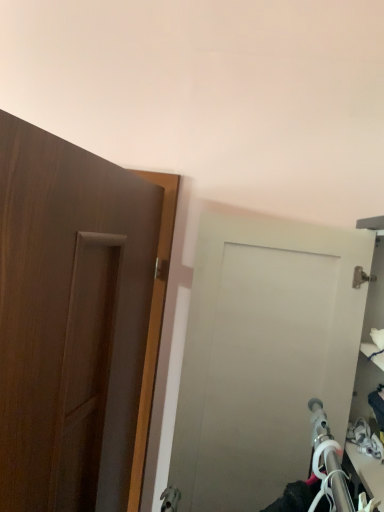
Question: Considering the relative sizes of wooden door at left, which is the first door from left to right, and matte white door at center, which is counted as the 2th door, starting from the left, in the image provided, is wooden door at left, which is the first door from left to right, bigger than matte white door at center, which is counted as the 2th door, starting from the left,?

Choices:
 (A) yes
 (B) no

Answer: (B)

Question: Is wooden door at left, which ranks as the second door in right-to-left order, far from matte white door at center, which is counted as the 2th door, starting from the left?

Choices:
 (A) no
 (B) yes

Answer: (A)

Question: Could you tell me if wooden door at left, which ranks as the second door in right-to-left order, is facing matte white door at center, the first door in the right-to-left sequence?

Choices:
 (A) yes
 (B) no

Answer: (A)

Question: Would you say wooden door at left, which ranks as the second door in right-to-left order, is outside matte white door at center, the first door in the right-to-left sequence?

Choices:
 (A) yes
 (B) no

Answer: (A)

Question: Is wooden door at left, which ranks as the second door in right-to-left order, oriented away from matte white door at center, the first door in the right-to-left sequence?

Choices:
 (A) no
 (B) yes

Answer: (B)

Question: From a real-world perspective, is wooden door at left, which ranks as the second door in right-to-left order, positioned over matte white door at center, which is counted as the 2th door, starting from the left, based on gravity?

Choices:
 (A) yes
 (B) no

Answer: (B)

Question: Does matte white door at center, which is counted as the 2th door, starting from the left, have a greater width compared to wooden door at left, which ranks as the second door in right-to-left order?

Choices:
 (A) no
 (B) yes

Answer: (B)

Question: Is wooden door at left, which ranks as the second door in right-to-left order, surrounded by matte white door at center, the first door in the right-to-left sequence?

Choices:
 (A) no
 (B) yes

Answer: (A)

Question: Considering the relative sizes of matte white door at center, the first door in the right-to-left sequence, and wooden door at left, which ranks as the second door in right-to-left order, in the image provided, is matte white door at center, the first door in the right-to-left sequence, bigger than wooden door at left, which ranks as the second door in right-to-left order,?

Choices:
 (A) no
 (B) yes

Answer: (B)

Question: From a real-world perspective, is matte white door at center, which is counted as the 2th door, starting from the left, physically below wooden door at left, which is the first door from left to right?

Choices:
 (A) yes
 (B) no

Answer: (B)

Question: From a real-world perspective, is matte white door at center, which is counted as the 2th door, starting from the left, over wooden door at left, which ranks as the second door in right-to-left order?

Choices:
 (A) yes
 (B) no

Answer: (A)

Question: Does matte white door at center, the first door in the right-to-left sequence, turn towards wooden door at left, which ranks as the second door in right-to-left order?

Choices:
 (A) yes
 (B) no

Answer: (A)

Question: From a real-world perspective, is wooden door at left, which ranks as the second door in right-to-left order, positioned above or below matte white door at center, the first door in the right-to-left sequence?

Choices:
 (A) above
 (B) below

Answer: (B)